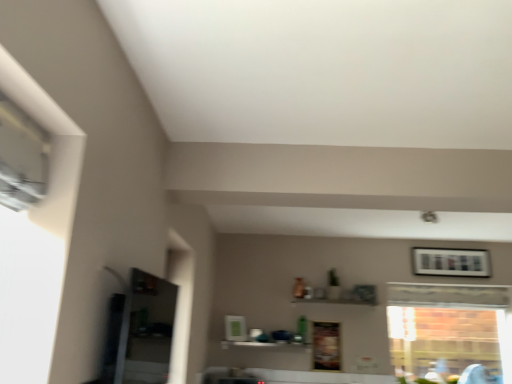
Question: From the image's perspective, is wooden framed picture at upper right located above or below clear glass window at right?

Choices:
 (A) above
 (B) below

Answer: (A)

Question: In the image, is wooden framed picture at upper right on the left side or the right side of clear glass window at right?

Choices:
 (A) left
 (B) right

Answer: (B)

Question: Which object is positioned farthest from the clear glass window at right?

Choices:
 (A) wooden framed picture at upper right
 (B) white glossy shelf at center

Answer: (B)

Question: Based on their relative distances, which object is nearer to the white glossy shelf at center?

Choices:
 (A) clear glass window at right
 (B) wooden framed picture at upper right

Answer: (B)